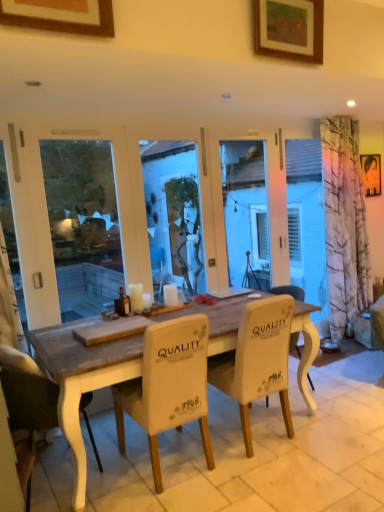
Question: Would you say white fabric chair at center, which is counted as the second chair, starting from the left, is to the left or to the right of wooden picture frame at upper center, which is counted as the third picture frame, starting from the right, in the picture?

Choices:
 (A) right
 (B) left

Answer: (A)

Question: Considering the positions of white fabric chair at center, the 2th chair when ordered from right to left, and wooden picture frame at upper center, the first picture frame viewed from the left, in the image, is white fabric chair at center, the 2th chair when ordered from right to left, taller or shorter than wooden picture frame at upper center, the first picture frame viewed from the left,?

Choices:
 (A) tall
 (B) short

Answer: (A)

Question: Which is nearer to the white fabric chair at center, which is the first chair in right-to-left order?

Choices:
 (A) white fabric chair at lower left, which ranks as the first chair in left-to-right order
 (B) metallic silver portrait at upper right, the 3th picture frame viewed from the left
 (C) matte glass bottle at center
 (D) white matte candle at center, which is the second candle in left-to-right order
 (E) white wax candle at center, the second candle viewed from the right

Answer: (D)

Question: Based on their relative distances, which object is nearer to the wooden picture frame at upper center, which is the 3th picture frame in back-to-front order?

Choices:
 (A) white wax candle at center, arranged as the 1th candle when viewed from the left
 (B) white fabric chair at lower left, which ranks as the first chair in left-to-right order
 (C) white fabric chair at center, the 2th chair when ordered from right to left
 (D) white fabric chair at center, the third chair viewed from the left
 (E) white matte candle at center, which is the first candle in right-to-left order

Answer: (B)